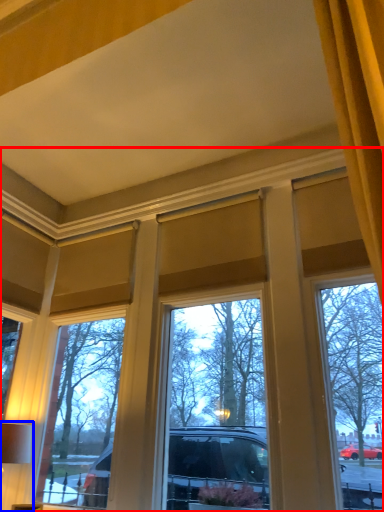
Question: Among these objects, which one is farthest to the camera, window (highlighted by a red box) or table lamp (highlighted by a blue box)?

Choices:
 (A) window
 (B) table lamp

Answer: (B)